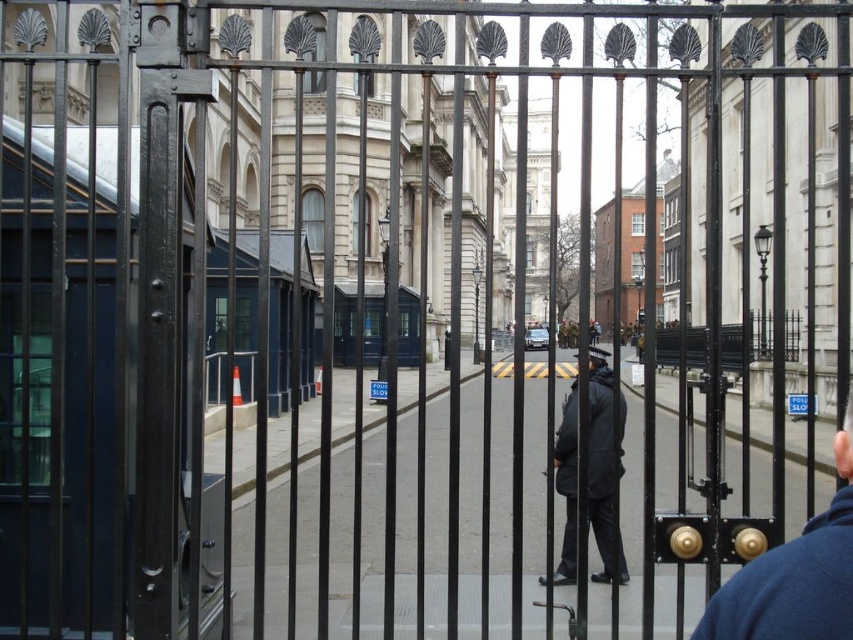
Question: Does blue fleece jacket at right come behind dark gray fabric jacket at center?

Choices:
 (A) no
 (B) yes

Answer: (A)

Question: Among these points, which one is nearest to the camera?

Choices:
 (A) (618, 563)
 (B) (787, 588)

Answer: (B)

Question: Is blue fleece jacket at right to the left of dark gray fabric jacket at center from the viewer's perspective?

Choices:
 (A) yes
 (B) no

Answer: (A)

Question: Where is blue fleece jacket at right located in relation to dark gray fabric jacket at center in the image?

Choices:
 (A) right
 (B) left

Answer: (B)